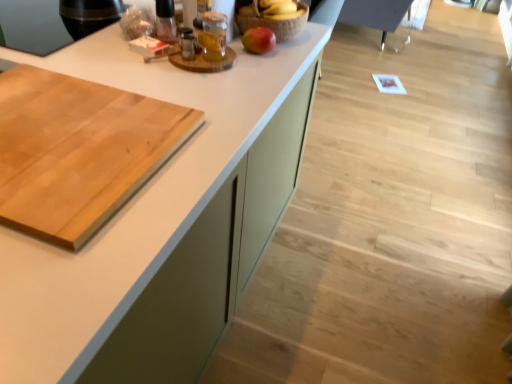
At what (x,y) coordinates should I click in order to perform the action: click on free location above natural wood cutting board at left (from a real-world perspective). Please return your answer as a coordinate pair (x, y). The image size is (512, 384). Looking at the image, I should click on (57, 129).